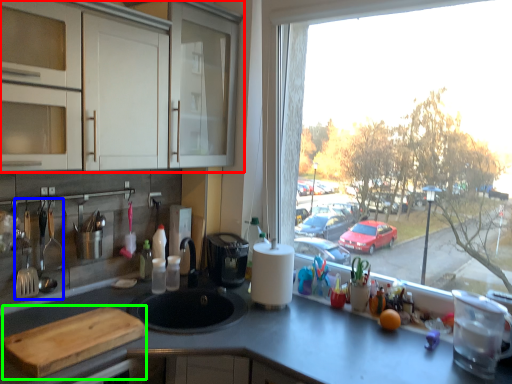
Question: Which object is positioned closest to cabinetry (highlighted by a red box)? Select from silverware (highlighted by a blue box) and cutting board (highlighted by a green box).

Choices:
 (A) silverware
 (B) cutting board

Answer: (A)